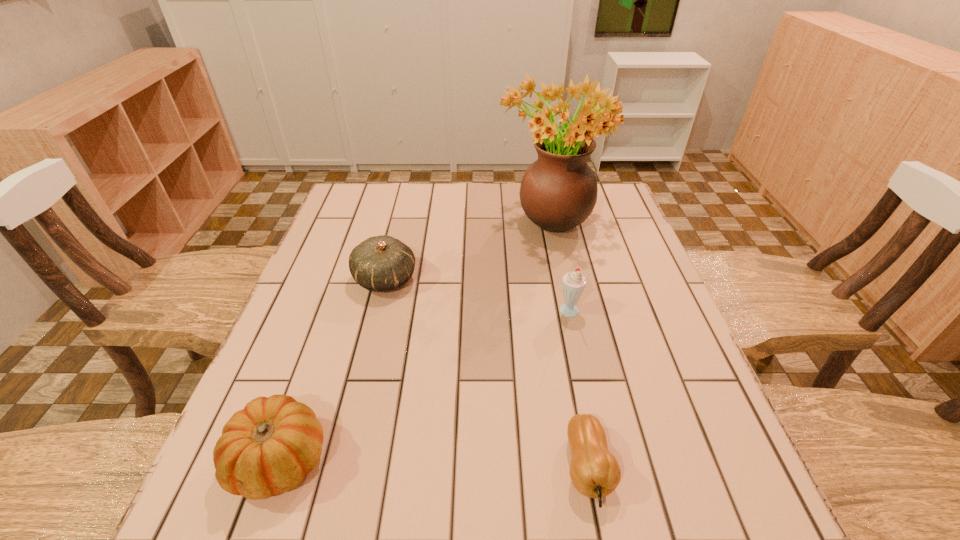
I want to click on vacant area at the near left corner, so click(207, 516).

Locate an element on the screen. This screenshot has width=960, height=540. blank area at the far right corner is located at coordinates (600, 215).

The width and height of the screenshot is (960, 540). What are the coordinates of `vacant point located between the rightmost gourd and the milkshake` in the screenshot? It's located at (579, 391).

Find the location of a particular element. The image size is (960, 540). vacant space in between the shortest gourd and the farthest object is located at coordinates (568, 343).

Locate an element on the screen. The width and height of the screenshot is (960, 540). free spot between the tallest object and the third farthest object is located at coordinates tap(560, 266).

The image size is (960, 540). In order to click on free spot between the flower arrangement and the second farthest object in this screenshot , I will do `click(468, 249)`.

Locate an element on the screen. This screenshot has width=960, height=540. vacant area between the shortest object and the flower arrangement is located at coordinates (568, 343).

Where is `empty space between the shortest object and the farthest object`? The image size is (960, 540). empty space between the shortest object and the farthest object is located at coordinates (568, 343).

Choose which object is the second nearest neighbor to the fourth shortest object. Please provide its 2D coordinates. Your answer should be formatted as a tuple, i.e. [(x, y)], where the tuple contains the x and y coordinates of a point satisfying the conditions above.

[(594, 471)]

This screenshot has height=540, width=960. I want to click on object that is the closest to the fourth nearest object, so click(x=558, y=192).